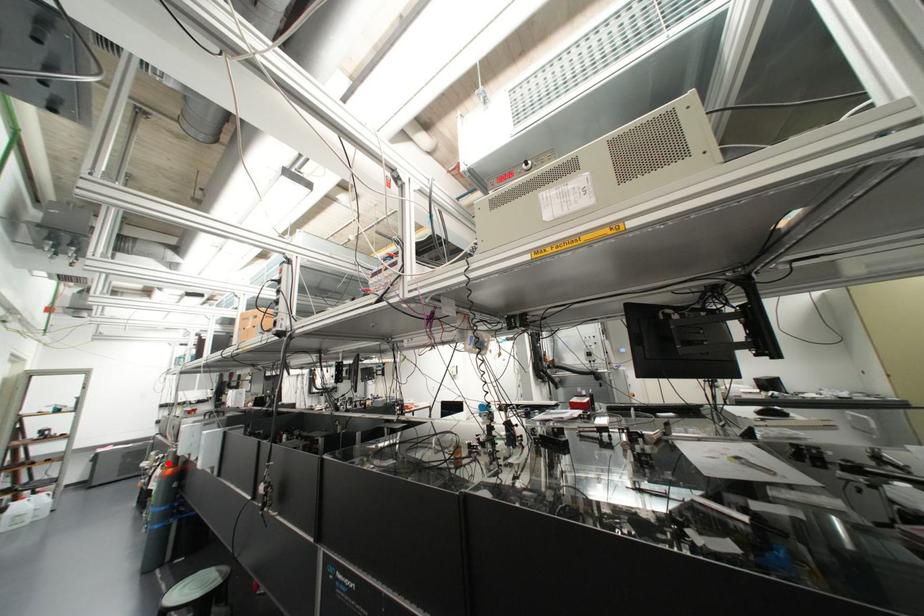
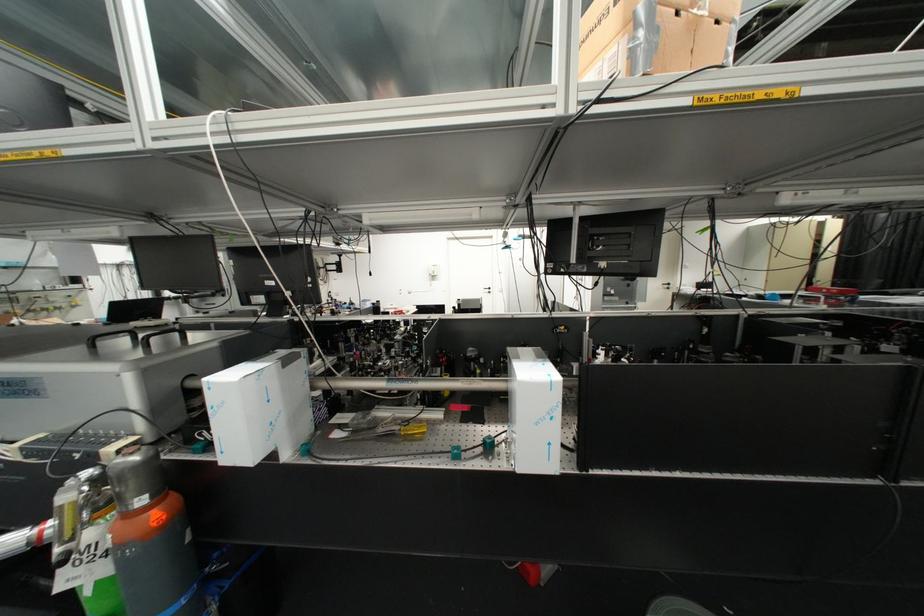
In the second image, find the point that corresponds to the highlighted location in the first image.

(140, 500)